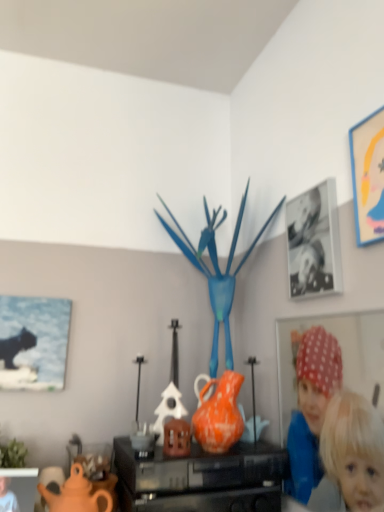
Question: From a real-world perspective, is black glossy photo frame at upper right, which ranks as the third picture frame in bottom-to-top order, positioned above or below matte orange vase at center?

Choices:
 (A) below
 (B) above

Answer: (B)

Question: In the image, is black glossy photo frame at upper right, positioned as the 2th picture frame in right-to-left order, positioned in front of or behind matte orange vase at center?

Choices:
 (A) behind
 (B) front

Answer: (A)

Question: Estimate the real-world distances between objects in this image. Which object is farther from the matte orange teapot at lower left?

Choices:
 (A) matte black picture frame at lower left, the second picture frame viewed from the left
 (B) matte black cat at left, the 2th picture frame from the bottom
 (C) orange matte vase at center
 (D) black glossy photo frame at upper right, arranged as the 3th picture frame when viewed from the left
 (E) matte yellow picture frame at upper right, which ranks as the 1th picture frame in right-to-left order

Answer: (E)

Question: Which object is the closest to the matte black picture frame at lower left, which is the 4th picture frame in top-to-bottom order?

Choices:
 (A) matte yellow picture frame at upper right, marked as the 4th picture frame in a left-to-right arrangement
 (B) matte black cat at left, the 2th picture frame from the bottom
 (C) black glossy photo frame at upper right, which ranks as the third picture frame in bottom-to-top order
 (D) matte orange teapot at lower left
 (E) orange matte vase at center

Answer: (D)